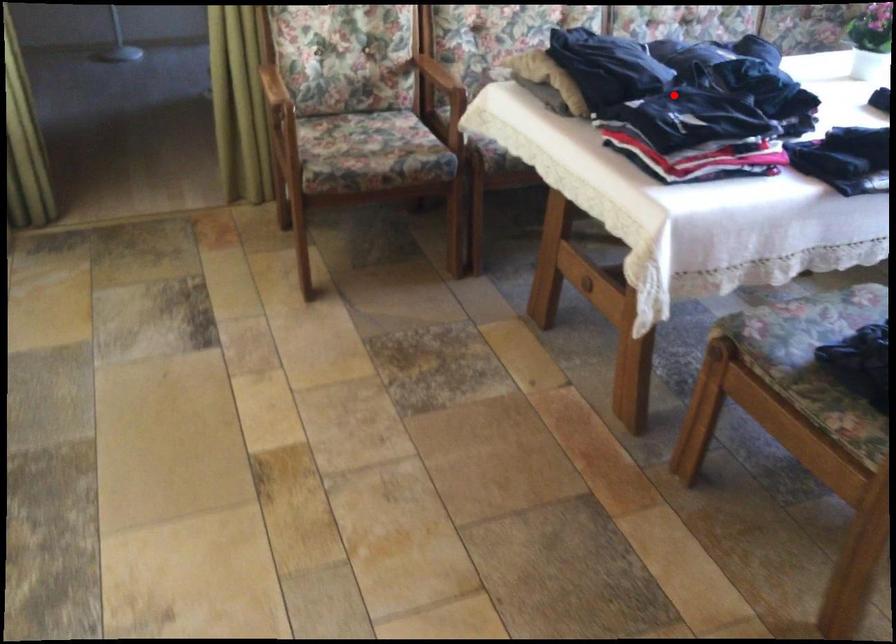
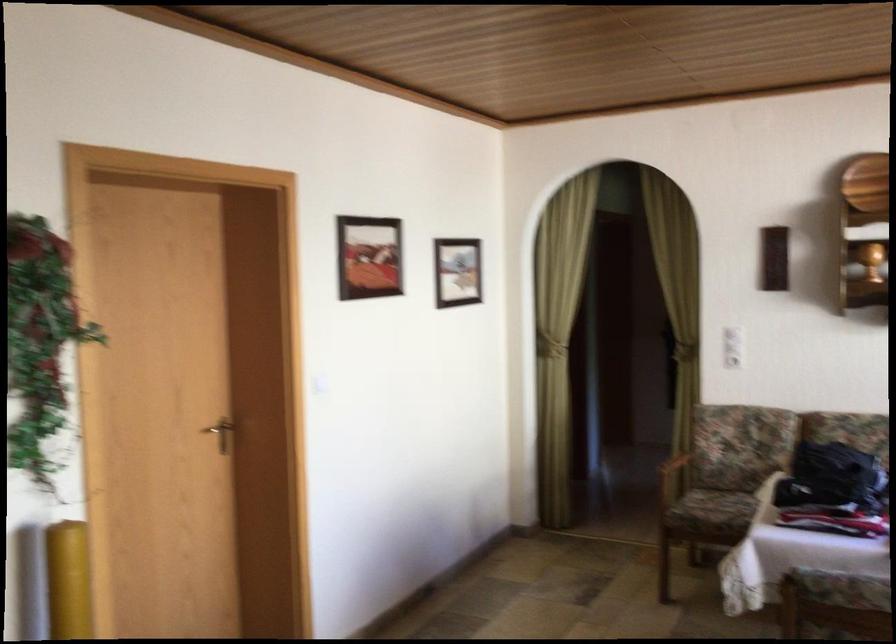
Find the pixel in the second image that matches the highlighted location in the first image.

(831, 478)